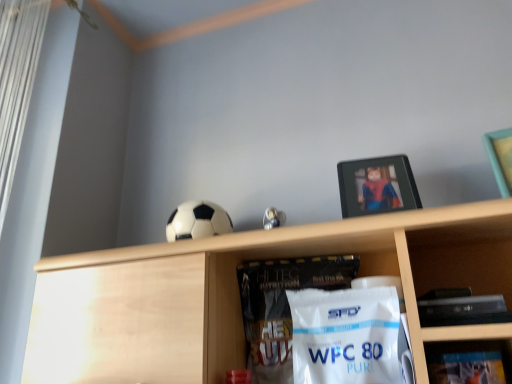
Question: Is metallic silver picture frame at upper center to the left of metallic silver frame at upper right, which is the 1th shelf from back to front, from the viewer's perspective?

Choices:
 (A) no
 (B) yes

Answer: (B)

Question: Is metallic silver picture frame at upper center directly adjacent to metallic silver frame at upper right, positioned as the second shelf in front-to-back order?

Choices:
 (A) no
 (B) yes

Answer: (A)

Question: Can you confirm if metallic silver picture frame at upper center is bigger than metallic silver frame at upper right, which ranks as the 1th shelf in right-to-left order?

Choices:
 (A) no
 (B) yes

Answer: (B)

Question: From the image's perspective, is metallic silver picture frame at upper center over metallic silver frame at upper right, which is the 1th shelf from back to front?

Choices:
 (A) yes
 (B) no

Answer: (A)

Question: Can you confirm if metallic silver picture frame at upper center is positioned to the right of metallic silver frame at upper right, which is the 1th shelf from back to front?

Choices:
 (A) no
 (B) yes

Answer: (A)

Question: From a real-world perspective, is metallic silver picture frame at upper center under metallic silver frame at upper right, which ranks as the 1th shelf in right-to-left order?

Choices:
 (A) no
 (B) yes

Answer: (A)

Question: Can you confirm if metallic silver frame at upper right, positioned as the second shelf in front-to-back order, is taller than metallic silver picture frame at upper center?

Choices:
 (A) no
 (B) yes

Answer: (A)

Question: Is metallic silver frame at upper right, which is the 1th shelf from back to front, facing towards metallic silver picture frame at upper center?

Choices:
 (A) no
 (B) yes

Answer: (A)

Question: Does metallic silver frame at upper right, which is the 1th shelf from back to front, have a greater width compared to metallic silver picture frame at upper center?

Choices:
 (A) no
 (B) yes

Answer: (A)

Question: Would you consider metallic silver frame at upper right, which is the 1th shelf from back to front, to be distant from metallic silver picture frame at upper center?

Choices:
 (A) no
 (B) yes

Answer: (A)

Question: From the image's perspective, is metallic silver frame at upper right, acting as the second shelf starting from the left, above metallic silver picture frame at upper center?

Choices:
 (A) yes
 (B) no

Answer: (B)

Question: Is the surface of metallic silver frame at upper right, which ranks as the 1th shelf in right-to-left order, in direct contact with metallic silver picture frame at upper center?

Choices:
 (A) no
 (B) yes

Answer: (A)

Question: Considering the relative sizes of metallic silver picture frame at upper center and black matte soccer ball at upper center in the image provided, is metallic silver picture frame at upper center thinner than black matte soccer ball at upper center?

Choices:
 (A) no
 (B) yes

Answer: (B)